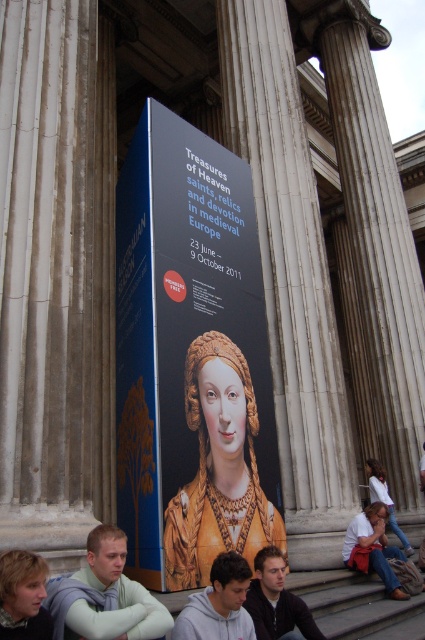
Which is above, blonde hair at lower left or matte gold necklace at lower center?

Positioned higher is blonde hair at lower left.

Does point (36, 634) come in front of point (376, 552)?

Yes, point (36, 634) is closer to viewer.

Where is `blonde hair at lower left`? blonde hair at lower left is located at coordinates (22, 596).

Is matte black poster at center positioned at the back of white cotton shirt at lower right?

No.

You are a GUI agent. You are given a task and a screenshot of the screen. Output one action in this format:
    pyautogui.click(x=<x>, y=<y>)
    Task: Click on the matte black poster at center
    
    Given the screenshot: What is the action you would take?
    pyautogui.click(x=190, y=358)

Locate an element on the screen. matte black poster at center is located at coordinates (190, 358).

Does point (147, 636) come in front of point (220, 561)?

That is True.

Which is behind, point (144, 589) or point (243, 637)?

The point (144, 589) is behind.

Locate an element on the screen. light green sweater at lower left is located at coordinates (104, 595).